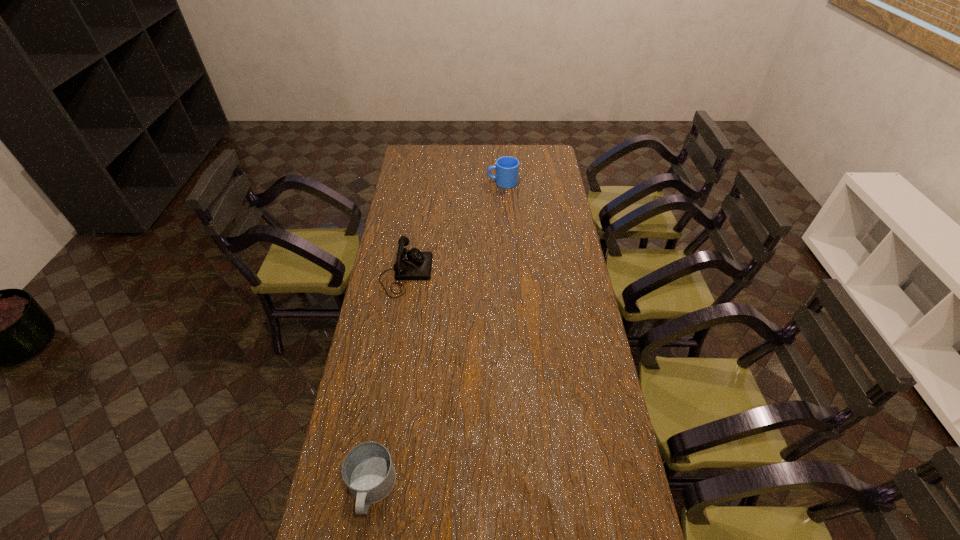
You are a GUI agent. You are given a task and a screenshot of the screen. Output one action in this format:
    pyautogui.click(x=<x>, y=<y>)
    Task: Click on the vacant area that lies between the farther mug and the shorter mug
    
    Given the screenshot: What is the action you would take?
    pyautogui.click(x=437, y=335)

Image resolution: width=960 pixels, height=540 pixels. I want to click on the second closest object to the rightmost object, so click(x=367, y=470).

Identify which object is located as the nearest to the shorter mug. Please provide its 2D coordinates. Your answer should be formatted as a tuple, i.e. [(x, y)], where the tuple contains the x and y coordinates of a point satisfying the conditions above.

[(413, 264)]

The height and width of the screenshot is (540, 960). What are the coordinates of `blank area in the image that satisfies the following two spatial constraints: 1. on the side of the farthest object with the handle; 2. on the side of the left mug with the handle` in the screenshot? It's located at (521, 488).

You are a GUI agent. You are given a task and a screenshot of the screen. Output one action in this format:
    pyautogui.click(x=<x>, y=<y>)
    Task: Click on the blank space that satisfies the following two spatial constraints: 1. on the side of the farthest object with the handle; 2. on the side of the nearer mug with the handle
    Image resolution: width=960 pixels, height=540 pixels.
    Given the screenshot: What is the action you would take?
    pyautogui.click(x=521, y=488)

Image resolution: width=960 pixels, height=540 pixels. I want to click on vacant point that satisfies the following two spatial constraints: 1. on the side of the farthest object with the handle; 2. on the side of the nearer mug with the handle, so click(x=521, y=488).